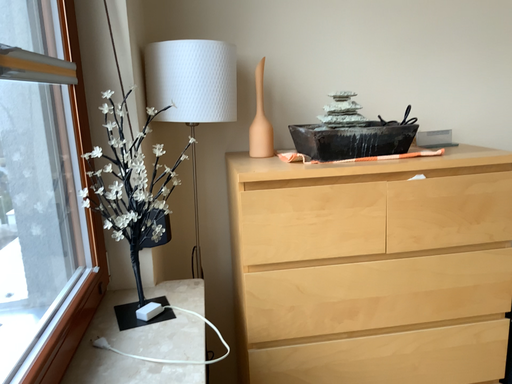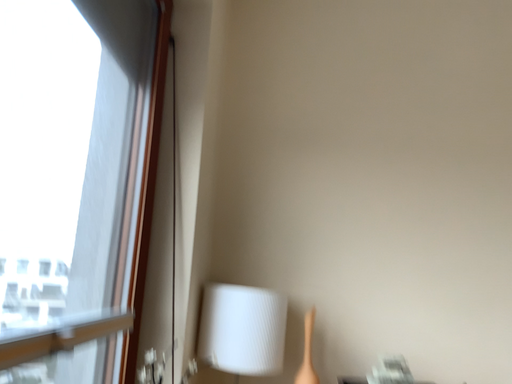
Question: How did the camera likely rotate when shooting the video?

Choices:
 (A) rotated right
 (B) rotated left

Answer: (B)